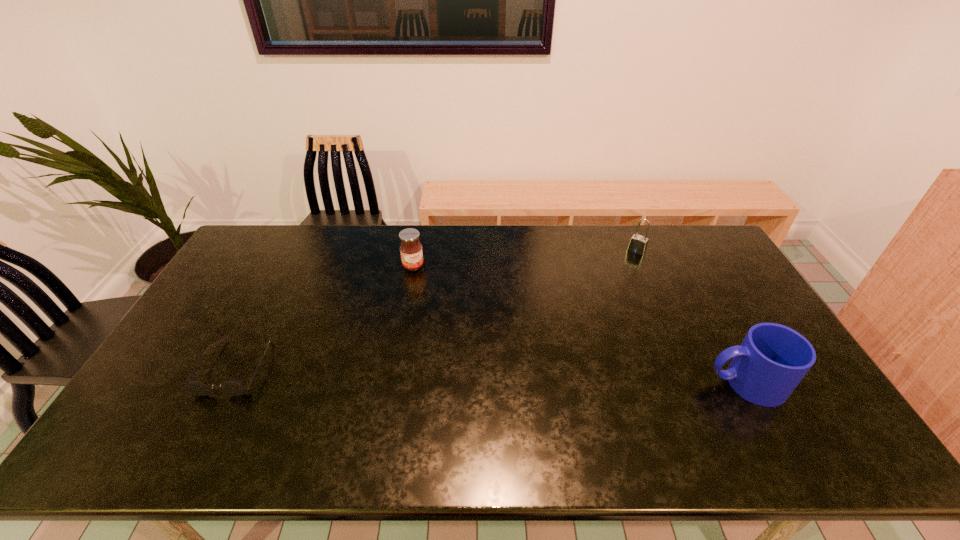
Where is `object that is at the right edge`? This screenshot has width=960, height=540. object that is at the right edge is located at coordinates (772, 360).

Find the location of a particular element. The width and height of the screenshot is (960, 540). object located in the near left corner section of the desktop is located at coordinates (234, 387).

The width and height of the screenshot is (960, 540). What are the coordinates of `object located in the near right corner section of the desktop` in the screenshot? It's located at (772, 360).

The image size is (960, 540). I want to click on free region at the far edge of the desktop, so (425, 233).

Identify the location of vacant space at the near edge of the desktop. (612, 406).

I want to click on vacant position at the left edge of the desktop, so click(230, 346).

This screenshot has width=960, height=540. What are the coordinates of `free space at the right edge of the desktop` in the screenshot? It's located at (708, 267).

You are a GUI agent. You are given a task and a screenshot of the screen. Output one action in this format:
    pyautogui.click(x=<x>, y=<y>)
    Task: Click on the free point at the far right corner
    Image resolution: width=960 pixels, height=540 pixels.
    Given the screenshot: What is the action you would take?
    pos(708,230)

The width and height of the screenshot is (960, 540). I want to click on free space that is in between the padlock and the mug, so click(691, 317).

You are a GUI agent. You are given a task and a screenshot of the screen. Output one action in this format:
    pyautogui.click(x=<x>, y=<y>)
    Task: Click on the unoccupied area between the sunglasses and the mug
    Image resolution: width=960 pixels, height=540 pixels.
    Given the screenshot: What is the action you would take?
    pyautogui.click(x=491, y=375)